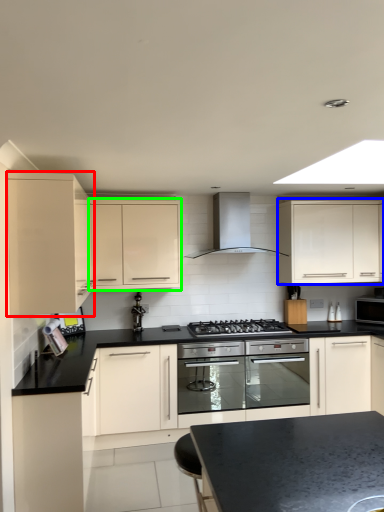
Question: Based on their relative distances, which object is nearer to cabinetry (highlighted by a red box)? Choose from cabinetry (highlighted by a blue box) and cabinetry (highlighted by a green box).

Choices:
 (A) cabinetry
 (B) cabinetry

Answer: (B)